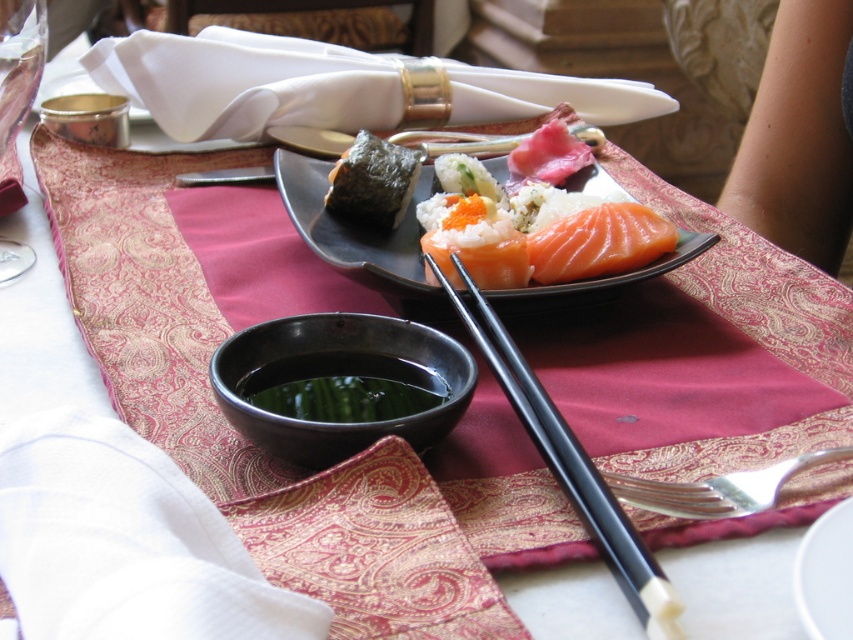
Question: Among these objects, which one is farthest from the camera?

Choices:
 (A) white rice with green garnish at center
 (B) shiny black plate at center

Answer: (A)

Question: Which is farther from the silver metallic fork at lower right?

Choices:
 (A) slick salmon at center
 (B) black glossy bowl at center
 (C) white glossy plate at center

Answer: (A)

Question: Among these objects, which one is farthest from the camera?

Choices:
 (A) white glossy plate at center
 (B) shiny black plate at center
 (C) seaweed wrapped sushi at center

Answer: (C)

Question: Does silver metallic fork at lower right have a larger size compared to white rice with green garnish at center?

Choices:
 (A) no
 (B) yes

Answer: (A)

Question: Is slick salmon at center wider than silver metallic fork at lower right?

Choices:
 (A) no
 (B) yes

Answer: (A)

Question: Does black glossy bowl at center have a greater width compared to slick salmon at center?

Choices:
 (A) no
 (B) yes

Answer: (B)